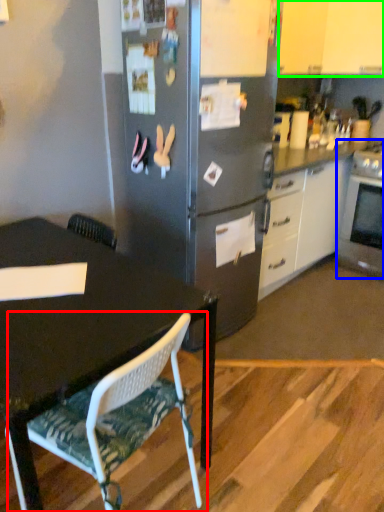
Question: Which is farther away from chair (highlighted by a red box)? oven (highlighted by a blue box) or cabinetry (highlighted by a green box)?

Choices:
 (A) oven
 (B) cabinetry

Answer: (B)